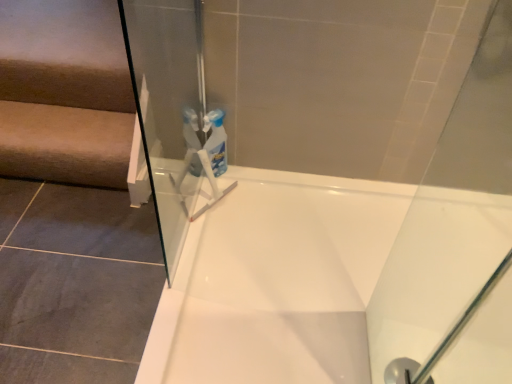
Question: Considering their positions, is beige fabric stairwell at left located in front of or behind transparent glass shower at lower right?

Choices:
 (A) behind
 (B) front

Answer: (A)

Question: Is beige fabric stairwell at left taller or shorter than transparent glass shower at lower right?

Choices:
 (A) short
 (B) tall

Answer: (B)

Question: Which of these objects is positioned closest to the transparent glass shower at lower right?

Choices:
 (A) white glossy bathtub at center
 (B) beige fabric stairwell at left

Answer: (A)

Question: Which object is positioned closest to the white glossy bathtub at center?

Choices:
 (A) beige fabric stairwell at left
 (B) transparent glass shower at lower right

Answer: (B)